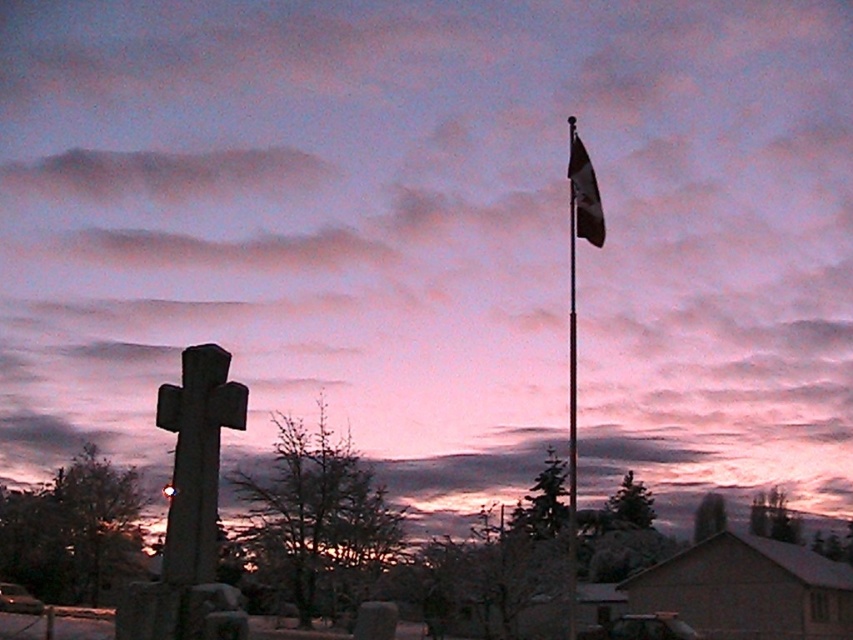
Consider the image. Is metallic pole at upper right thinner than metallic flagpole at right?

Indeed, metallic pole at upper right has a lesser width compared to metallic flagpole at right.

What do you see at coordinates (575, 317) in the screenshot? This screenshot has height=640, width=853. I see `metallic pole at upper right` at bounding box center [575, 317].

Locate an element on the screen. The image size is (853, 640). metallic pole at upper right is located at coordinates (575, 317).

Which is more to the left, metallic flagpole at right or dark blue fabric flag at upper right?

dark blue fabric flag at upper right is more to the left.

Which of these two, metallic flagpole at right or dark blue fabric flag at upper right, stands shorter?

With less height is dark blue fabric flag at upper right.

Does point (572, 200) lie in front of point (590, 189)?

That is False.

Where is `metallic flagpole at right`? This screenshot has height=640, width=853. metallic flagpole at right is located at coordinates (572, 388).

Who is more forward, (596, 195) or (589, 188)?

Point (596, 195)

Where is `metallic pole at upper right`? The image size is (853, 640). metallic pole at upper right is located at coordinates (575, 317).